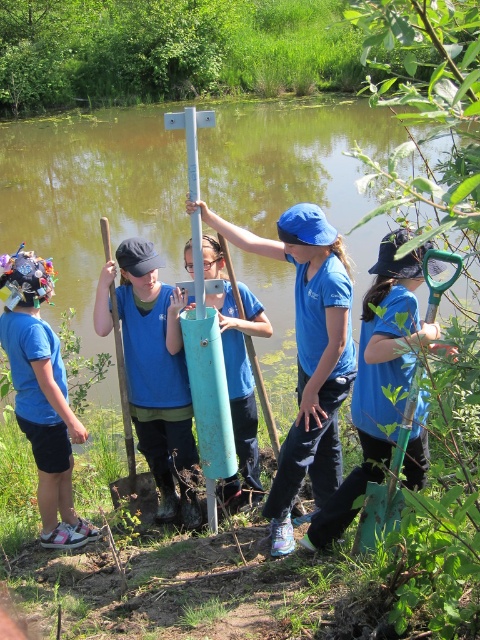
Can you confirm if matte blue cylinder at center is thinner than matte blue shirt at left?

No.

Is matte blue cylinder at center to the left of matte blue shirt at left from the viewer's perspective?

In fact, matte blue cylinder at center is to the right of matte blue shirt at left.

Where is `matte blue cylinder at center`? The width and height of the screenshot is (480, 640). matte blue cylinder at center is located at coordinates (308, 353).

Can you confirm if teal matte cylinder at center is taller than wooden shovel at center?

Yes, teal matte cylinder at center is taller than wooden shovel at center.

Is point (251, 413) positioned in front of point (129, 435)?

No, it is behind (129, 435).

Is point (249, 492) positioned after point (130, 442)?

Yes, point (249, 492) is behind point (130, 442).

Where is `teal matte cylinder at center`? teal matte cylinder at center is located at coordinates (240, 385).

Is matte blue shirt at left bigger than metallic silver pole at center?

Actually, matte blue shirt at left might be smaller than metallic silver pole at center.

Can you confirm if matte blue shirt at left is positioned to the right of metallic silver pole at center?

In fact, matte blue shirt at left is to the left of metallic silver pole at center.

Is point (9, 259) behind point (214, 118)?

Yes, it is behind point (214, 118).

Locate an element on the screen. matte blue shirt at left is located at coordinates (41, 394).